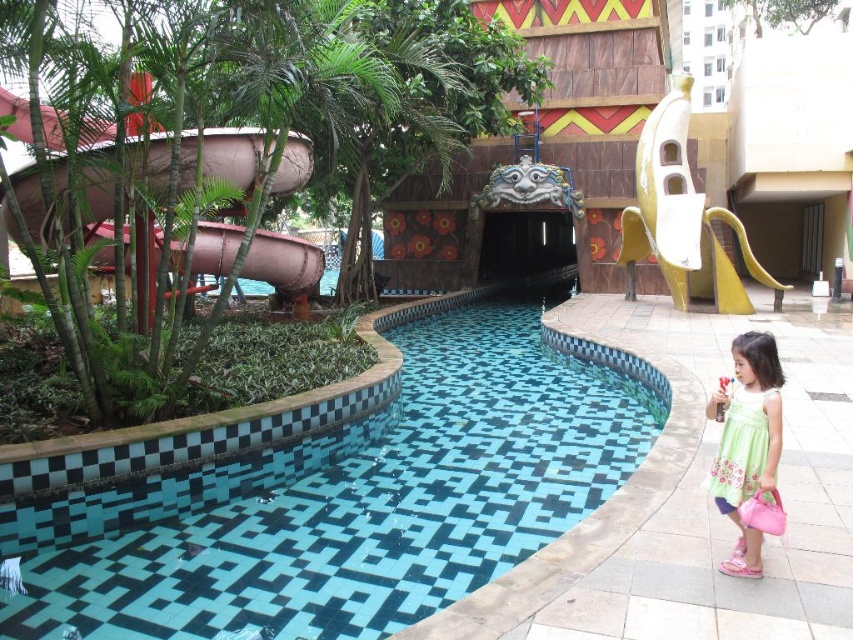
You are planning to take a photo of the blue mosaic tiles at center and the green floral dress at lower right. Which object should you focus on first if you want to capture both in the same frame without moving the camera?

You should focus on the blue mosaic tiles at center first because it is positioned on the left side of the green floral dress at lower right, so keeping the blue mosaic tiles at center in the left part of the frame and the green floral dress at lower right on the right will ensure both are in the same shot.